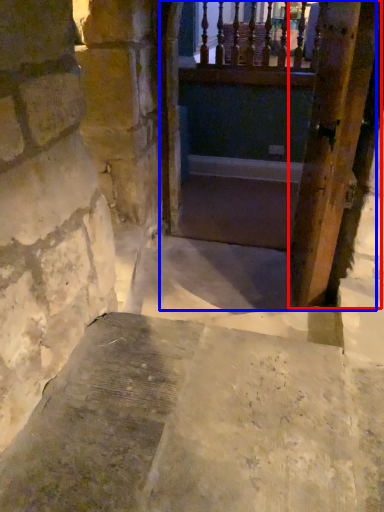
Question: Which of the following is the farthest to the observer, door (highlighted by a red box) or tunnel (highlighted by a blue box)?

Choices:
 (A) door
 (B) tunnel

Answer: (B)